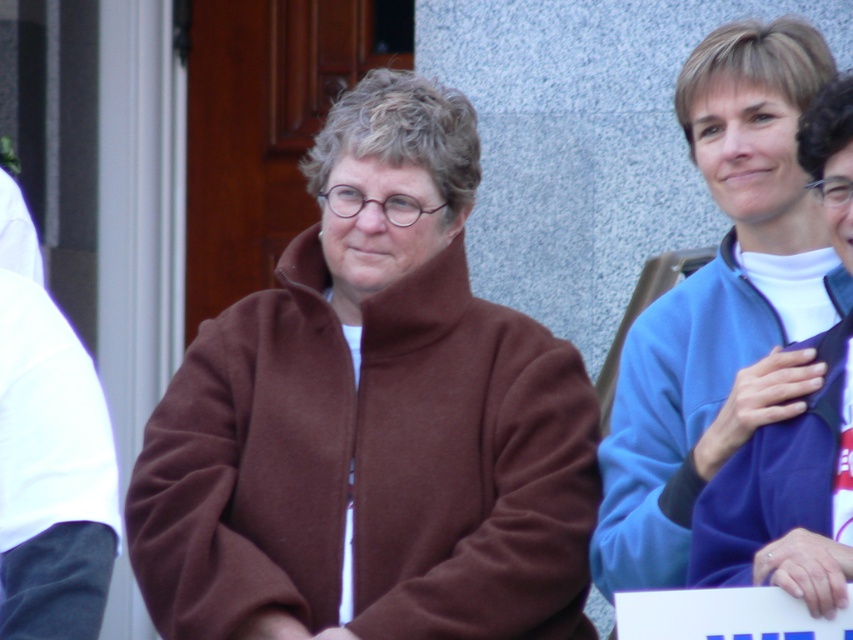
Is point (605, 484) in front of point (65, 385)?

Yes.

Measure the distance between blue fleece jacket at right and camera.

14.39 meters

Locate an element on the screen. The width and height of the screenshot is (853, 640). blue fleece jacket at right is located at coordinates (721, 304).

Image resolution: width=853 pixels, height=640 pixels. I want to click on blue fleece jacket at right, so click(721, 304).

Is brown fleece jacket at center smaller than white fabric at left?

No, brown fleece jacket at center is not smaller than white fabric at left.

Who is taller, brown fleece jacket at center or white fabric at left?

With more height is brown fleece jacket at center.

In order to click on brown fleece jacket at center in this screenshot , I will do `click(372, 419)`.

Between brown fleece jacket at center and blue fleece jacket at right, which one appears on the right side from the viewer's perspective?

Positioned to the right is blue fleece jacket at right.

Who is more forward, (500,612) or (627,554)?

Point (627,554)

Describe the element at coordinates (372, 419) in the screenshot. I see `brown fleece jacket at center` at that location.

The height and width of the screenshot is (640, 853). I want to click on brown fleece jacket at center, so click(372, 419).